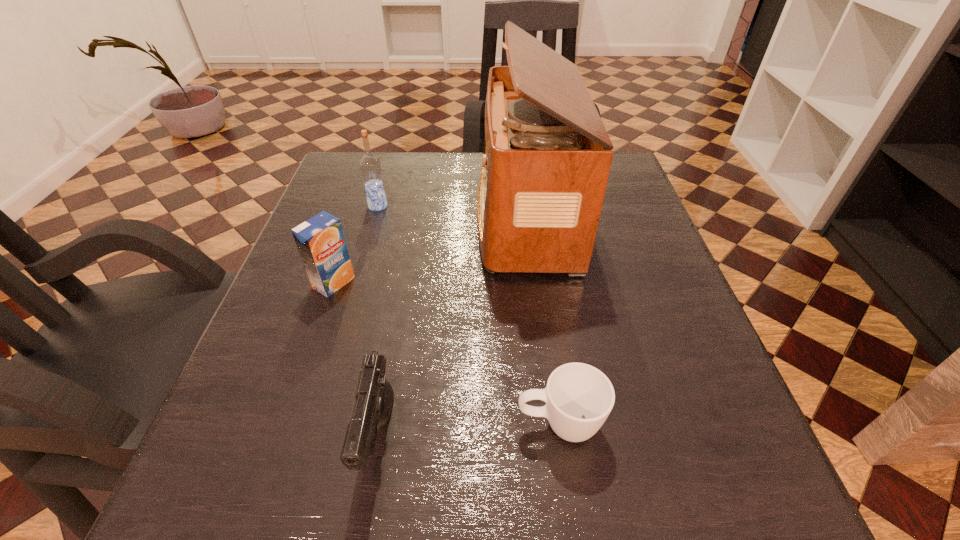
You are a GUI agent. You are given a task and a screenshot of the screen. Output one action in this format:
    pyautogui.click(x=<x>, y=<y>)
    Task: Click on the tallest object
    The width and height of the screenshot is (960, 540).
    Given the screenshot: What is the action you would take?
    pyautogui.click(x=547, y=155)

Find the location of a particular element. This screenshot has height=540, width=960. the fourth shortest object is located at coordinates (370, 167).

You are a GUI agent. You are given a task and a screenshot of the screen. Output one action in this format:
    pyautogui.click(x=<x>, y=<y>)
    Task: Click on the orange_juice
    The height and width of the screenshot is (540, 960).
    Given the screenshot: What is the action you would take?
    pyautogui.click(x=320, y=240)

Identify the location of the second shortest object. (372, 407).

Identify the location of pistol. This screenshot has width=960, height=540. (372, 407).

Identify the location of the shortest object. (579, 397).

You are a GUI agent. You are given a task and a screenshot of the screen. Output one action in this format:
    pyautogui.click(x=<x>, y=<y>)
    Task: Click on the vacant region located on the front panel of the tallest object
    
    Given the screenshot: What is the action you would take?
    pyautogui.click(x=427, y=216)

Where is `vacant area located 0.290m on the front panel of the tallest object`? This screenshot has height=540, width=960. vacant area located 0.290m on the front panel of the tallest object is located at coordinates (347, 216).

At what (x,y) coordinates should I click in order to perform the action: click on vacant space located on the front panel of the tallest object. Please return your answer as a coordinate pair (x, y). The image size is (960, 540). Looking at the image, I should click on (347, 216).

I want to click on vacant region located on the right of the second tallest object, so click(x=419, y=206).